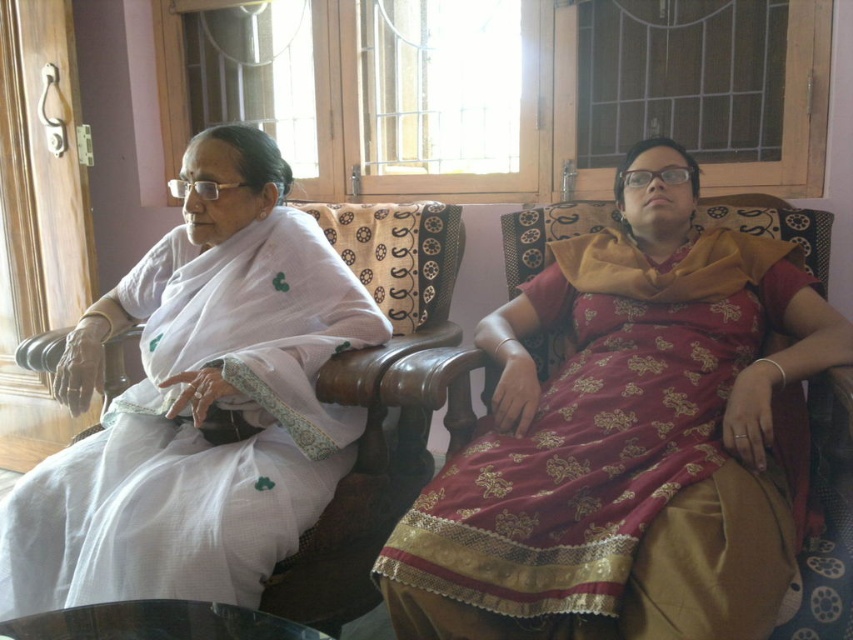
Does point (431, 540) lie behind point (349, 273)?

No, it is not.

Who is more forward, (670, 380) or (262, 525)?

Positioned in front is point (262, 525).

The image size is (853, 640). Describe the element at coordinates (630, 442) in the screenshot. I see `maroon satin saree at center` at that location.

In order to click on maroon satin saree at center in this screenshot , I will do `click(630, 442)`.